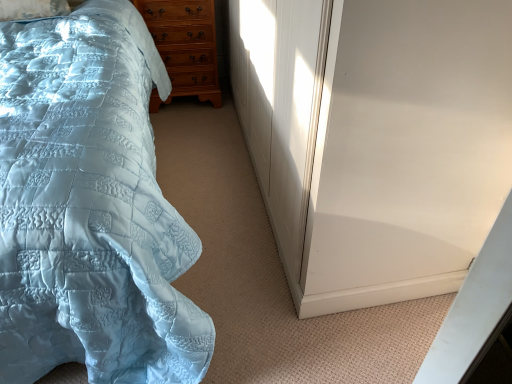
Measure the distance between white glossy screen door at right and camera.

white glossy screen door at right is 82.51 centimeters away from camera.

What is the approximate width of light brown wooden chest of drawers at upper left?

light brown wooden chest of drawers at upper left is 14.22 inches in width.

You are a GUI agent. You are given a task and a screenshot of the screen. Output one action in this format:
    pyautogui.click(x=<x>, y=<y>)
    Task: Click on the light blue quilted bed at left
    
    Given the screenshot: What is the action you would take?
    pyautogui.click(x=90, y=207)

In the image, is light brown wooden chest of drawers at upper left positioned in front of or behind white glossy screen door at right?

Visually, light brown wooden chest of drawers at upper left is located behind white glossy screen door at right.

Is light brown wooden chest of drawers at upper left positioned with its back to white glossy screen door at right?

No.

Find the location of a particular element. This screenshot has height=384, width=512. screen door in front of the light brown wooden chest of drawers at upper left is located at coordinates (407, 150).

Is light brown wooden chest of drawers at upper left thinner than white glossy screen door at right?

Correct, the width of light brown wooden chest of drawers at upper left is less than that of white glossy screen door at right.

Locate an element on the screen. bed that appears below the white glossy screen door at right (from the image's perspective) is located at coordinates (90, 207).

Could you tell me if light blue quilted bed at left is turned towards white glossy screen door at right?

No, light blue quilted bed at left is not facing towards white glossy screen door at right.

Is light blue quilted bed at left smaller than white glossy screen door at right?

No, light blue quilted bed at left is not smaller than white glossy screen door at right.

Considering the positions of objects light blue quilted bed at left and white glossy screen door at right in the image provided, who is more to the right, light blue quilted bed at left or white glossy screen door at right?

white glossy screen door at right.

From a real-world perspective, is light blue quilted bed at left located higher than light brown wooden chest of drawers at upper left?

Yes, from a real-world perspective, light blue quilted bed at left is above light brown wooden chest of drawers at upper left.

Which object is positioned more to the left, light blue quilted bed at left or light brown wooden chest of drawers at upper left?

light blue quilted bed at left is more to the left.

Is light blue quilted bed at left turned away from light brown wooden chest of drawers at upper left?

light blue quilted bed at left is not turned away from light brown wooden chest of drawers at upper left.

Is light blue quilted bed at left located outside light brown wooden chest of drawers at upper left?

light blue quilted bed at left is positioned outside light brown wooden chest of drawers at upper left.

Is light brown wooden chest of drawers at upper left turned away from light blue quilted bed at left?

Yes.

Is light brown wooden chest of drawers at upper left shorter than light blue quilted bed at left?

Yes.

From the image's perspective, between light brown wooden chest of drawers at upper left and light blue quilted bed at left, which one is located above?

light brown wooden chest of drawers at upper left.

Looking at the image, does light brown wooden chest of drawers at upper left seem bigger or smaller compared to light blue quilted bed at left?

In the image, light brown wooden chest of drawers at upper left appears to be smaller than light blue quilted bed at left.

Considering the sizes of white glossy screen door at right and light brown wooden chest of drawers at upper left in the image, is white glossy screen door at right bigger or smaller than light brown wooden chest of drawers at upper left?

white glossy screen door at right is bigger than light brown wooden chest of drawers at upper left.

From the image's perspective, which one is positioned lower, white glossy screen door at right or light brown wooden chest of drawers at upper left?

From the image's view, white glossy screen door at right is below.

Is white glossy screen door at right with light brown wooden chest of drawers at upper left?

No.

How many degrees apart are the facing directions of white glossy screen door at right and light brown wooden chest of drawers at upper left?

90.7 degrees separate the facing orientations of white glossy screen door at right and light brown wooden chest of drawers at upper left.

Can you confirm if white glossy screen door at right is wider than light blue quilted bed at left?

No, white glossy screen door at right is not wider than light blue quilted bed at left.

Between point (321, 115) and point (4, 99), which one is positioned behind?

The point (4, 99) is behind.

From a real-world perspective, does white glossy screen door at right stand above light blue quilted bed at left?

No, from a real-world perspective, white glossy screen door at right is not above light blue quilted bed at left.

Is white glossy screen door at right inside or outside of light blue quilted bed at left?

white glossy screen door at right is located beyond the bounds of light blue quilted bed at left.

Image resolution: width=512 pixels, height=384 pixels. In the image, there is a light brown wooden chest of drawers at upper left. Find the location of `screen door below it (from the image's perspective)`. screen door below it (from the image's perspective) is located at coordinates (407, 150).

Locate an element on the screen. This screenshot has height=384, width=512. screen door located underneath the light blue quilted bed at left (from a real-world perspective) is located at coordinates (407, 150).

Looking at the image, which one is located closer to light brown wooden chest of drawers at upper left, white glossy screen door at right or light blue quilted bed at left?

Based on the image, light blue quilted bed at left appears to be nearer to light brown wooden chest of drawers at upper left.

Considering their positions, is white glossy screen door at right positioned closer to light blue quilted bed at left than light brown wooden chest of drawers at upper left?

white glossy screen door at right is closer to light blue quilted bed at left.

When comparing their distances from light blue quilted bed at left, does light brown wooden chest of drawers at upper left or white glossy screen door at right seem further?

light brown wooden chest of drawers at upper left is positioned further to the anchor light blue quilted bed at left.

Looking at this image, estimate the real-world distances between objects in this image. Which object is closer to white glossy screen door at right, light blue quilted bed at left or light brown wooden chest of drawers at upper left?

The object closer to white glossy screen door at right is light blue quilted bed at left.

When comparing their distances from white glossy screen door at right, does light brown wooden chest of drawers at upper left or light blue quilted bed at left seem closer?

light blue quilted bed at left is closer to white glossy screen door at right.

Based on their spatial positions, is light blue quilted bed at left or white glossy screen door at right further from light brown wooden chest of drawers at upper left?

white glossy screen door at right is positioned further to the anchor light brown wooden chest of drawers at upper left.

Find the location of `screen door positioned between light blue quilted bed at left and light brown wooden chest of drawers at upper left from near to far`. screen door positioned between light blue quilted bed at left and light brown wooden chest of drawers at upper left from near to far is located at coordinates (407, 150).